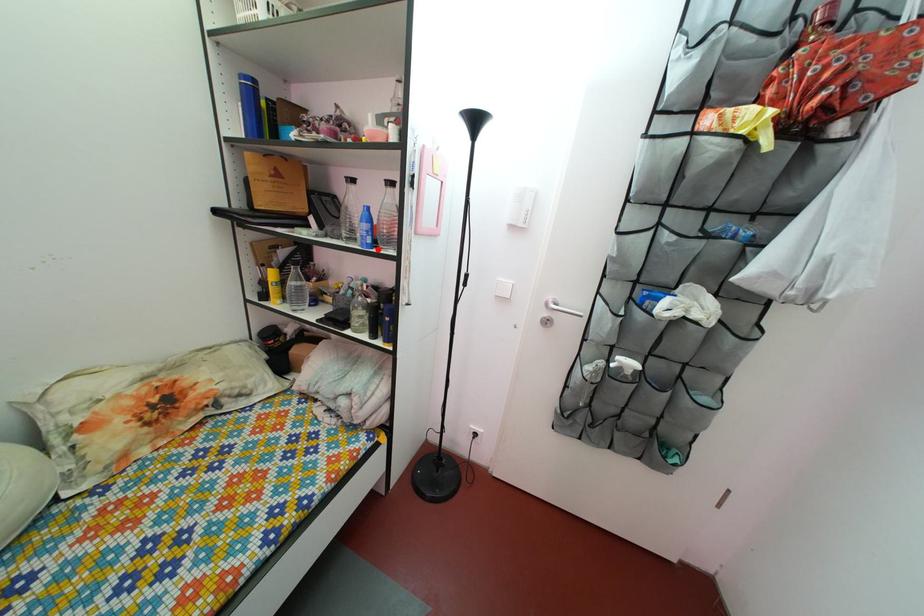
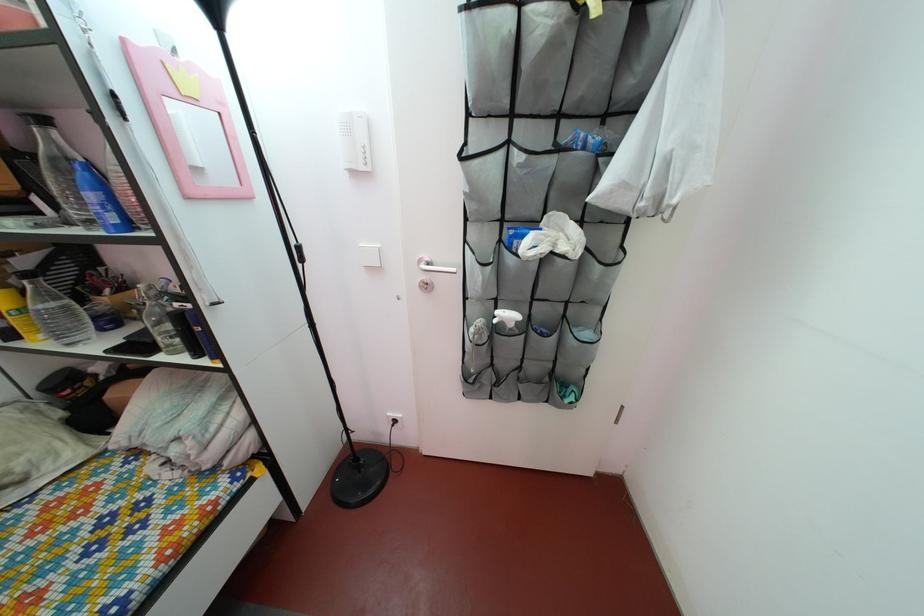
Locate, in the second image, the point that corresponds to the highlighted location in the first image.

(124, 229)